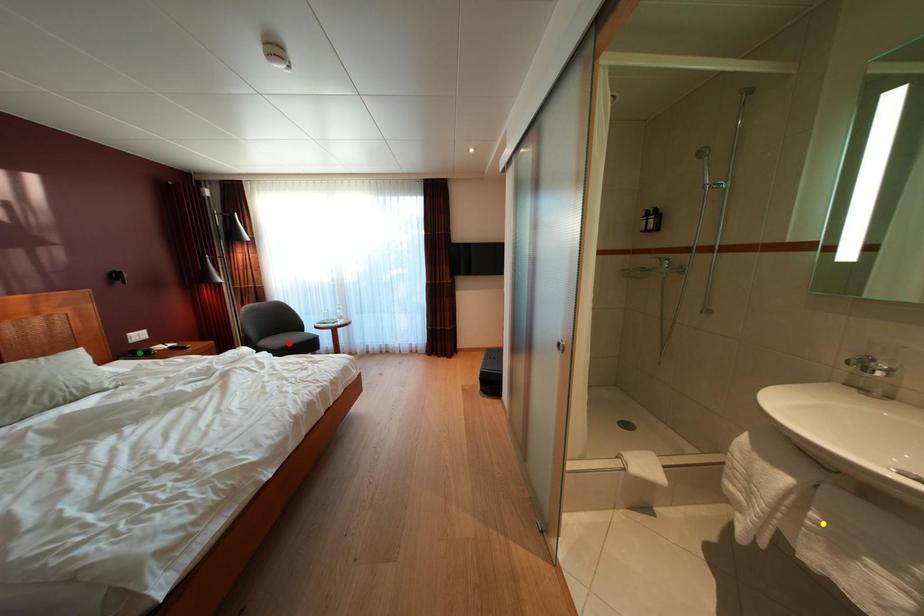
Order these from nearest to farthest:
1. green point
2. yellow point
3. red point

yellow point, green point, red point